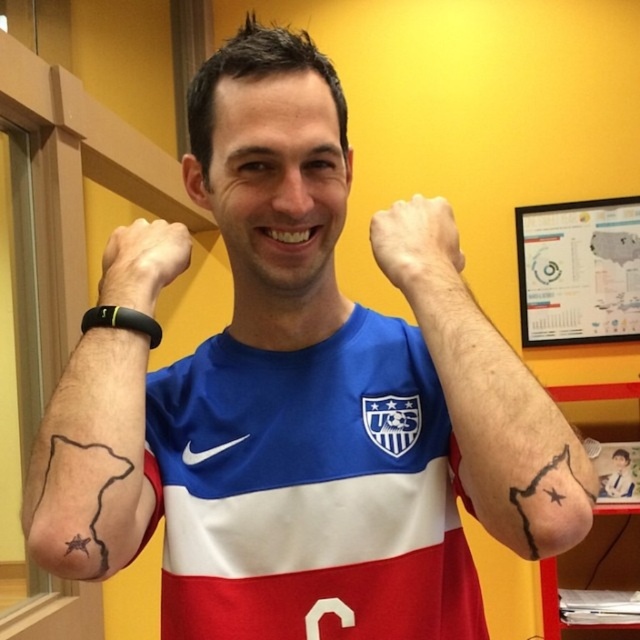
You are a photographer setting up for a soccer team photo. You notice the white matte hand at center and the black rubber wristband at upper left in the frame. Which object is positioned more to the right side of the image?

The white matte hand at center is positioned more to the right side of the image than the black rubber wristband at upper left.

You are a photographer capturing the man in the image. You notice the white matte hand at center and the black rubber wristband at upper left. Which object is closer to the camera?

The white matte hand at center is positioned under the black rubber wristband at upper left, meaning the wristband is closer to the camera.